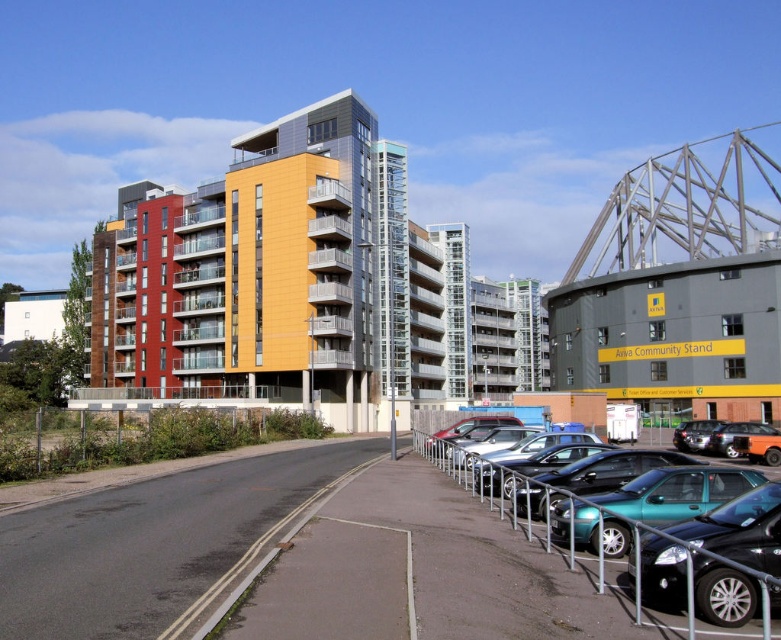
Question: Based on their relative distances, which object is farther from the metallic silver car at center?

Choices:
 (A) shiny black car at lower right
 (B) metallic gray parking lot at center

Answer: (A)

Question: Among these objects, which one is nearest to the camera?

Choices:
 (A) shiny black car at lower right
 (B) teal metallic car at center
 (C) shiny black sedan at center
 (D) teal metallic car at right

Answer: (D)

Question: Estimate the real-world distances between objects in this image. Which object is farther from the teal metallic car at center?

Choices:
 (A) shiny black car at lower right
 (B) metallic silver car at center
 (C) shiny black sedan at center
 (D) metallic gray parking lot at center

Answer: (C)

Question: Can you confirm if teal metallic car at center is positioned to the left of metallic silver car at center?

Choices:
 (A) no
 (B) yes

Answer: (A)

Question: In this image, where is shiny black sedan at center located relative to metallic silver car at center?

Choices:
 (A) right
 (B) left

Answer: (A)

Question: Can you confirm if shiny black car at lower right is thinner than shiny black sedan at center?

Choices:
 (A) no
 (B) yes

Answer: (B)